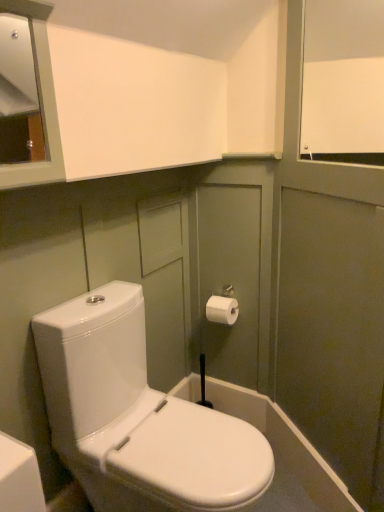
The width and height of the screenshot is (384, 512). What do you see at coordinates (343, 77) in the screenshot?
I see `white matte window screen at upper right` at bounding box center [343, 77].

What is the approximate height of white paper toilet paper at upper right?

white paper toilet paper at upper right is 4.20 inches tall.

At what (x,y) coordinates should I click in order to perform the action: click on white paper toilet paper at upper right. Please return your answer as a coordinate pair (x, y). Image resolution: width=384 pixels, height=512 pixels. Looking at the image, I should click on (222, 310).

What are the coordinates of `white matte window screen at upper right` in the screenshot? It's located at (343, 77).

From the image's perspective, who appears lower, white glossy toilet at center or white matte window screen at upper right?

From the image's view, white glossy toilet at center is below.

From a real-world perspective, between white glossy toilet at center and white matte window screen at upper right, who is vertically lower?

From a 3D spatial view, white glossy toilet at center is below.

Are white glossy toilet at center and white matte window screen at upper right far apart?

Yes, white glossy toilet at center and white matte window screen at upper right are quite far apart.

Is point (88, 462) farther from camera compared to point (380, 24)?

That is False.

Is white glossy toilet at center surrounding white paper toilet paper at upper right?

No, white paper toilet paper at upper right is located outside of white glossy toilet at center.

Is white glossy toilet at center shorter than white paper toilet paper at upper right?

No.

Considering the relative positions of white glossy toilet at center and white paper toilet paper at upper right in the image provided, is white glossy toilet at center behind white paper toilet paper at upper right?

No, white glossy toilet at center is closer to the camera.

In the image, is white matte window screen at upper right on the left side or the right side of white paper toilet paper at upper right?

white matte window screen at upper right is positioned on white paper toilet paper at upper right's right side.

Is white matte window screen at upper right aimed at white paper toilet paper at upper right?

No, white matte window screen at upper right is not oriented towards white paper toilet paper at upper right.

From a real-world perspective, which is physically below, white matte window screen at upper right or white paper toilet paper at upper right?

white paper toilet paper at upper right.

Does point (367, 130) appear closer or farther from the camera than point (223, 315)?

Clearly, point (367, 130) is closer to the camera than point (223, 315).

Is white paper toilet paper at upper right oriented away from white glossy toilet at center?

No, white glossy toilet at center is not at the back of white paper toilet paper at upper right.

Would you say white paper toilet paper at upper right contains white glossy toilet at center?

No, white glossy toilet at center is not inside white paper toilet paper at upper right.

Can you see white paper toilet paper at upper right touching white glossy toilet at center?

No, white paper toilet paper at upper right is not making contact with white glossy toilet at center.

Considering the points (226, 298) and (127, 291), which point is in front, point (226, 298) or point (127, 291)?

Point (127, 291)

Is white glossy toilet at center surrounded by white matte window screen at upper right?

No, white glossy toilet at center is not surrounded by white matte window screen at upper right.

Where is `window screen above the white glossy toilet at center (from a real-world perspective)`? Image resolution: width=384 pixels, height=512 pixels. window screen above the white glossy toilet at center (from a real-world perspective) is located at coordinates (343, 77).

Considering the sizes of objects white paper toilet paper at upper right and white matte window screen at upper right in the image provided, who is wider, white paper toilet paper at upper right or white matte window screen at upper right?

With larger width is white paper toilet paper at upper right.

In the scene shown: Considering the relative sizes of white paper toilet paper at upper right and white matte window screen at upper right in the image provided, is white paper toilet paper at upper right bigger than white matte window screen at upper right?

Incorrect, white paper toilet paper at upper right is not larger than white matte window screen at upper right.

Is white paper toilet paper at upper right not inside white matte window screen at upper right?

That's correct, white paper toilet paper at upper right is outside of white matte window screen at upper right.

From the image's perspective, is white paper toilet paper at upper right above or below white matte window screen at upper right?

Based on their image positions, white paper toilet paper at upper right is located beneath white matte window screen at upper right.

In order to click on toilet below the white matte window screen at upper right (from a real-world perspective) in this screenshot , I will do `click(137, 416)`.

Locate an element on the screen. The width and height of the screenshot is (384, 512). toiletry positioned vertically above the white glossy toilet at center (from a real-world perspective) is located at coordinates (222, 310).

Considering their positions, is white paper toilet paper at upper right positioned closer to white matte window screen at upper right than white glossy toilet at center?

white paper toilet paper at upper right.

Looking at the image, which one is located closer to white glossy toilet at center, white paper toilet paper at upper right or white matte window screen at upper right?

white paper toilet paper at upper right.

Considering their positions, is white glossy toilet at center positioned further to white matte window screen at upper right than white paper toilet paper at upper right?

white glossy toilet at center is positioned further to the anchor white matte window screen at upper right.

Estimate the real-world distances between objects in this image. Which object is further from white paper toilet paper at upper right, white matte window screen at upper right or white glossy toilet at center?

white matte window screen at upper right is positioned further to the anchor white paper toilet paper at upper right.

Based on their spatial positions, is white matte window screen at upper right or white paper toilet paper at upper right closer to white glossy toilet at center?

The object closer to white glossy toilet at center is white paper toilet paper at upper right.

When comparing their distances from white paper toilet paper at upper right, does white glossy toilet at center or white matte window screen at upper right seem closer?

white glossy toilet at center lies closer to white paper toilet paper at upper right than the other object.

Locate an element on the screen. The image size is (384, 512). toiletry between white matte window screen at upper right and white glossy toilet at center from top to bottom is located at coordinates (222, 310).